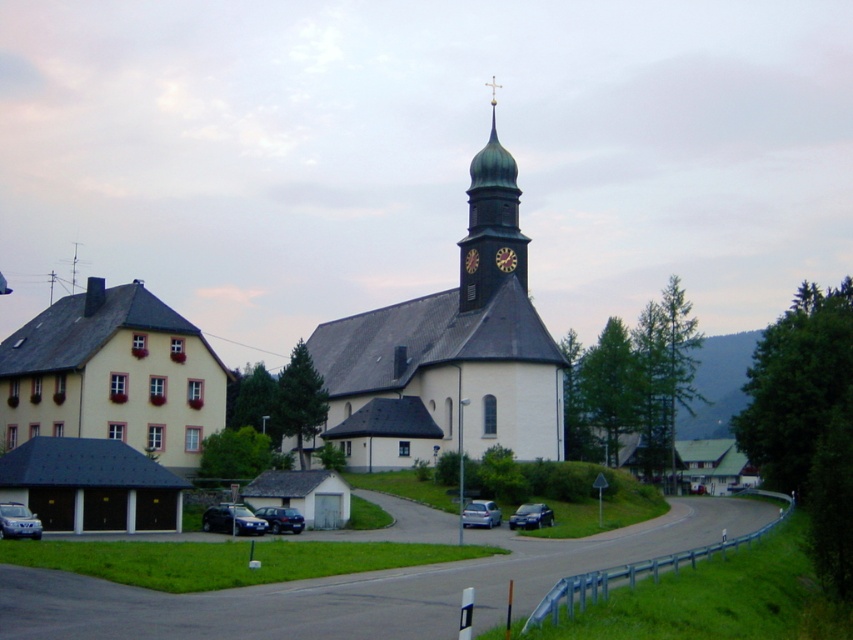
Question: Among these objects, which one is farthest from the camera?

Choices:
 (A) yellow matte building at left
 (B) silver metallic sedan at lower center

Answer: (A)

Question: Which of the following is the farthest from the observer?

Choices:
 (A) (257, 515)
 (B) (537, 506)

Answer: (B)

Question: Can you confirm if yellow matte building at left is thinner than silver metallic sedan at lower center?

Choices:
 (A) yes
 (B) no

Answer: (B)

Question: Can you confirm if metallic blue sedan at lower center is smaller than dark brown wooden clock at center?

Choices:
 (A) yes
 (B) no

Answer: (A)

Question: Which of the following is the closest to the observer?

Choices:
 (A) metallic blue sedan at lower center
 (B) dark brown wooden clock at center
 (C) silver metallic car at lower left

Answer: (C)

Question: Can you confirm if metallic blue sedan at lower left is positioned to the left of dark brown wooden clock at center?

Choices:
 (A) no
 (B) yes

Answer: (B)